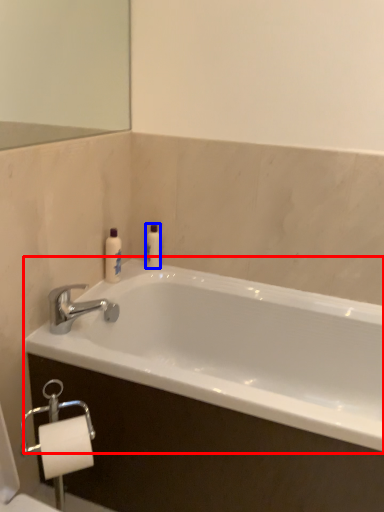
Question: Which object appears closest to the camera in this image, bathtub (highlighted by a red box) or toiletry (highlighted by a blue box)?

Choices:
 (A) bathtub
 (B) toiletry

Answer: (A)